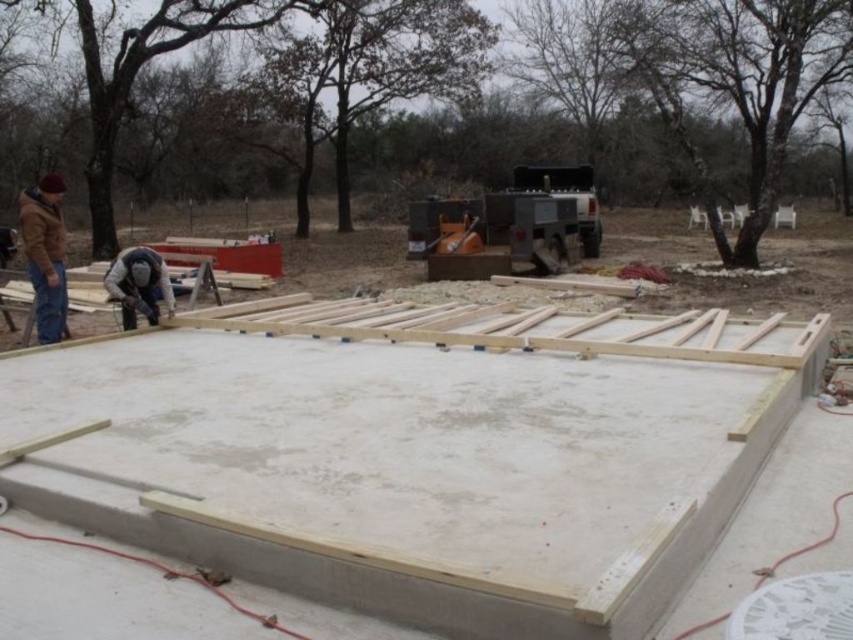
Question: Which object is closer to the camera taking this photo?

Choices:
 (A) brown leather jacket at left
 (B) light brown wood at center

Answer: (B)

Question: Does light brown wood at center appear on the left side of brown leather jacket at left?

Choices:
 (A) no
 (B) yes

Answer: (A)

Question: Which of the following is the farthest from the observer?

Choices:
 (A) light brown wood at center
 (B) brown leather jacket at left

Answer: (B)

Question: Does light brown wood at center have a larger size compared to brown leather jacket at left?

Choices:
 (A) no
 (B) yes

Answer: (A)

Question: Is light brown wood at center smaller than brown leather jacket at left?

Choices:
 (A) yes
 (B) no

Answer: (A)

Question: Which point appears closest to the camera in this image?

Choices:
 (A) (477, 493)
 (B) (55, 260)

Answer: (A)